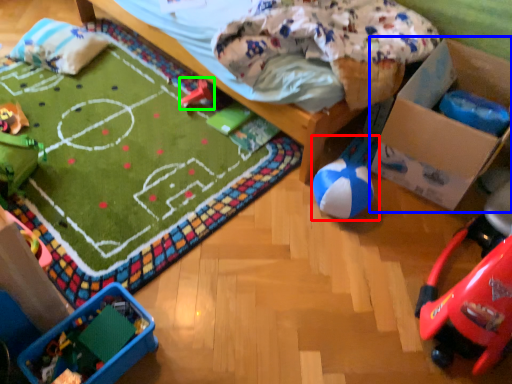
Question: Which is farther away from toy (highlighted by a red box)? cardboard box (highlighted by a blue box) or toy (highlighted by a green box)?

Choices:
 (A) cardboard box
 (B) toy

Answer: (B)